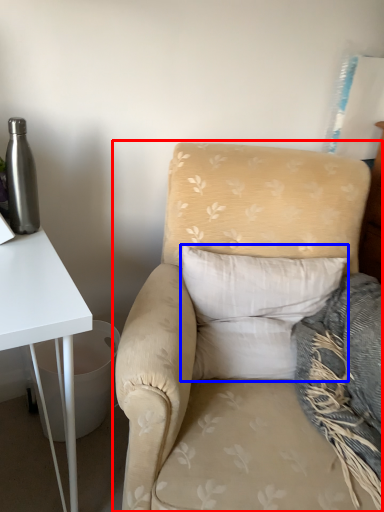
Question: Which object is closer to the camera taking this photo, chair (highlighted by a red box) or pillow (highlighted by a blue box)?

Choices:
 (A) chair
 (B) pillow

Answer: (A)